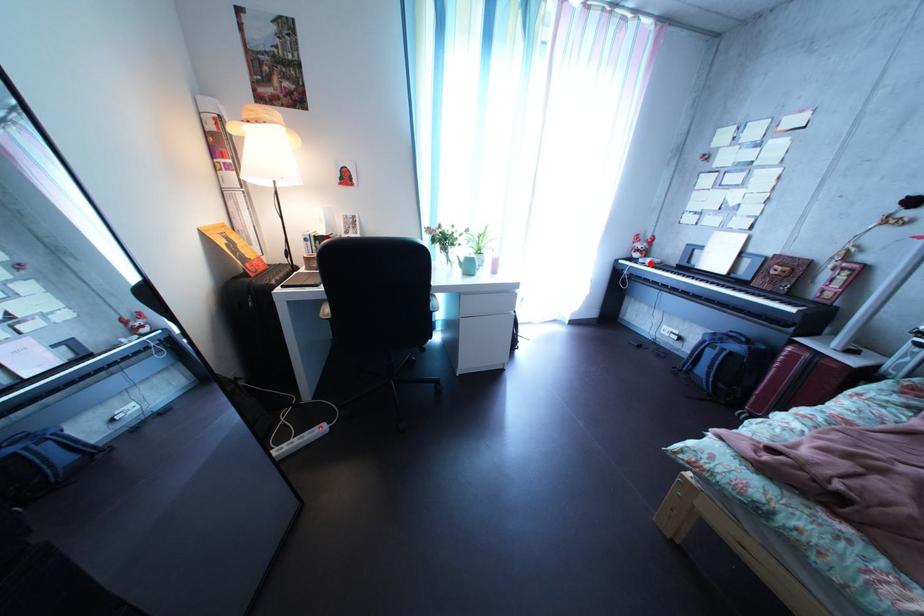
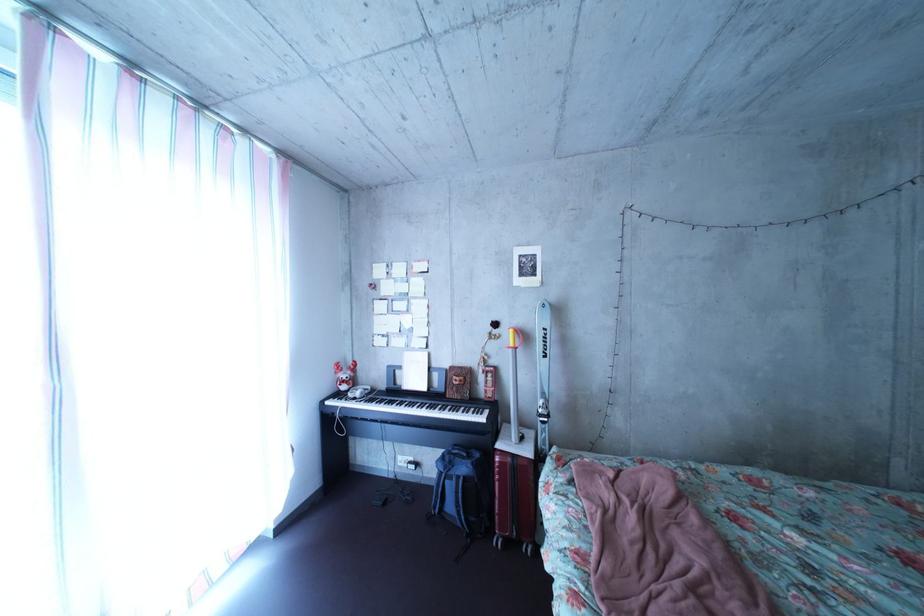
Question: A red point is marked in image1. In image2, is the corresponding 3D point closer to the camera or farther? Reply with the corresponding letter.

Choices:
 (A) The corresponding 3D point is closer.
 (B) The corresponding 3D point is farther.

Answer: (B)